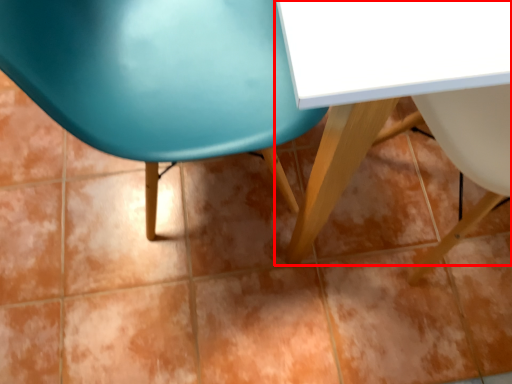
Question: In this image, where is table (annotated by the red box) located relative to chair?

Choices:
 (A) left
 (B) right

Answer: (B)